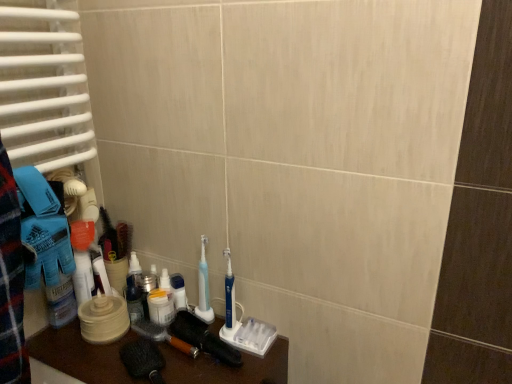
The image size is (512, 384). Identify the location of vacant area in front of translucent plastic container at center, which is the second toiletry in right-to-left order. (95, 352).